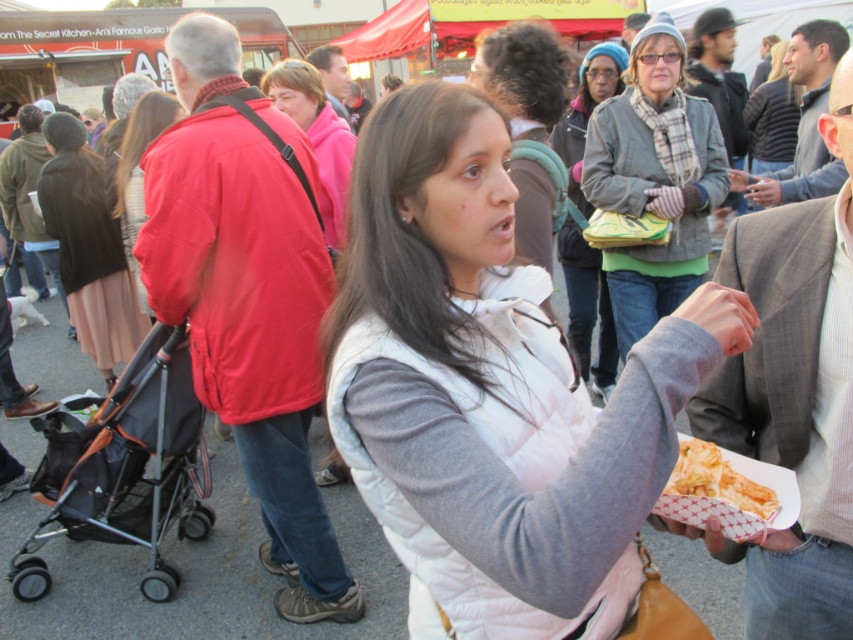
Question: Is orange fabric stroller at left thinner than matte black jacket at upper left?

Choices:
 (A) no
 (B) yes

Answer: (B)

Question: In this image, where is white matte vest at center located relative to gray wool sweater at center?

Choices:
 (A) above
 (B) below

Answer: (B)

Question: Among these objects, which one is farthest from the camera?

Choices:
 (A) shiny paper food at center
 (B) gray wool scarf at upper center
 (C) matte black jacket at upper left
 (D) gray wool sweater at center

Answer: (C)

Question: Is shiny paper food at center positioned at the back of smooth red jacket at upper center?

Choices:
 (A) no
 (B) yes

Answer: (A)

Question: Which object is the closest to the red matte jacket at upper left?

Choices:
 (A) white matte vest at center
 (B) smooth red jacket at upper center
 (C) matte black jacket at upper left

Answer: (C)

Question: Which object is closer to the camera taking this photo?

Choices:
 (A) white quilted vest at center
 (B) gray wool sweater at center

Answer: (A)